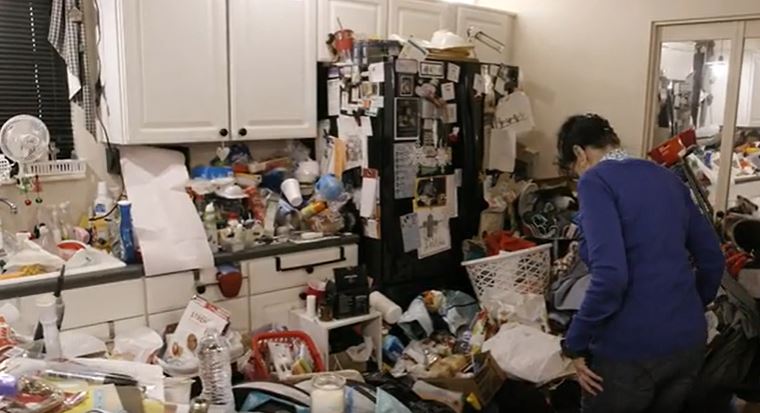
At what (x,y) coordinates should I click in order to perform the action: click on candle. Please return your answer as a coordinate pair (x, y). The width and height of the screenshot is (760, 413). Looking at the image, I should click on (336, 389).